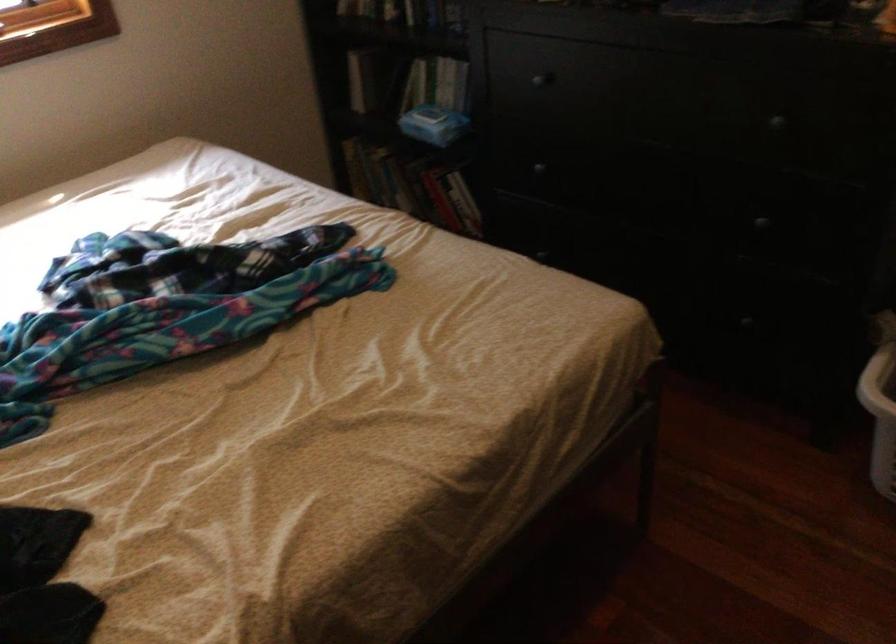
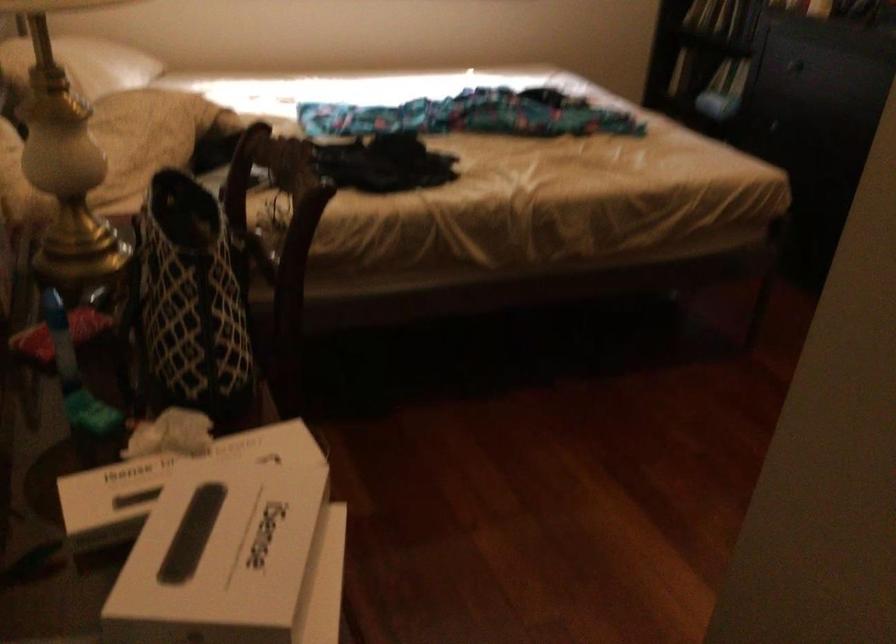
In a continuous first-person perspective shot, in which direction is the camera moving?

The cameraman moved toward right, backward.